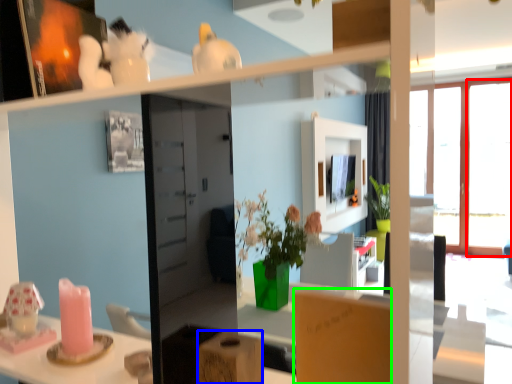
Question: Which is farther away from window (highlighted by a red box)? cardboard box (highlighted by a blue box) or cardboard box (highlighted by a green box)?

Choices:
 (A) cardboard box
 (B) cardboard box

Answer: (A)